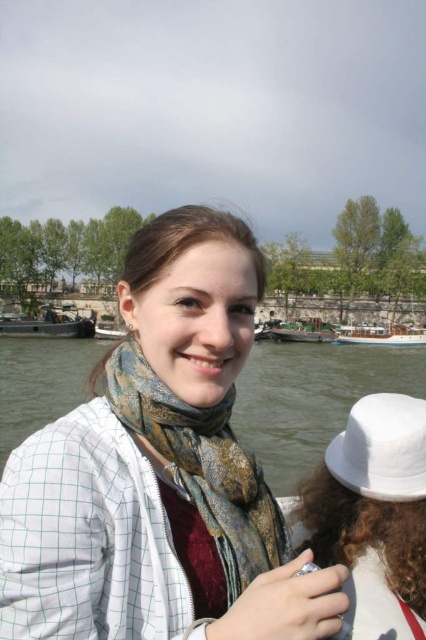
Question: Which object is farther from the camera taking this photo?

Choices:
 (A) white matte hat at lower right
 (B) green water at lower left
 (C) white matte hat at upper right

Answer: (B)

Question: Where is white checkered shirt at center located in relation to white glossy boat at center in the image?

Choices:
 (A) above
 (B) below

Answer: (B)

Question: Does printed silk scarf at center come behind wooden boat at center?

Choices:
 (A) no
 (B) yes

Answer: (A)

Question: Is wooden boat at center in front of wooden boat at left?

Choices:
 (A) yes
 (B) no

Answer: (B)

Question: Which object is positioned closest to the white matte hat at lower right?

Choices:
 (A) wooden boat at left
 (B) wooden boat at center

Answer: (B)

Question: Estimate the real-world distances between objects in this image. Which object is farther from the white matte hat at upper right?

Choices:
 (A) white checkered shirt at center
 (B) printed silk scarf at center

Answer: (A)